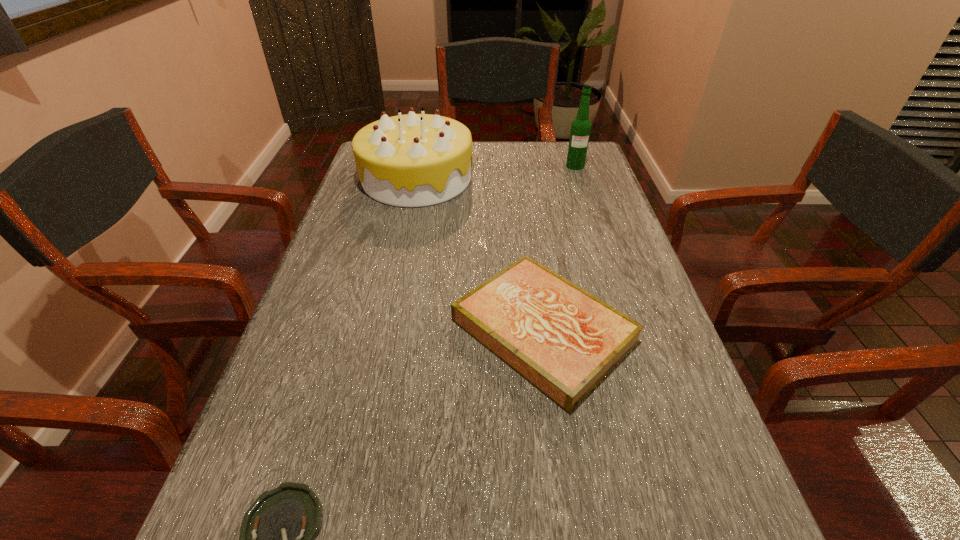
Find the location of a particular element. object that ranks as the closest to the beer bottle is located at coordinates (414, 160).